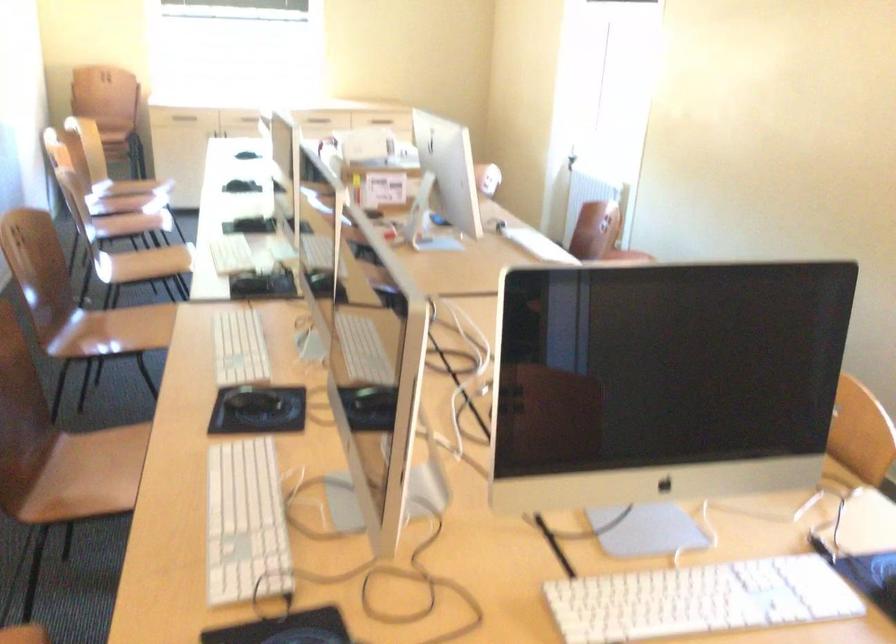
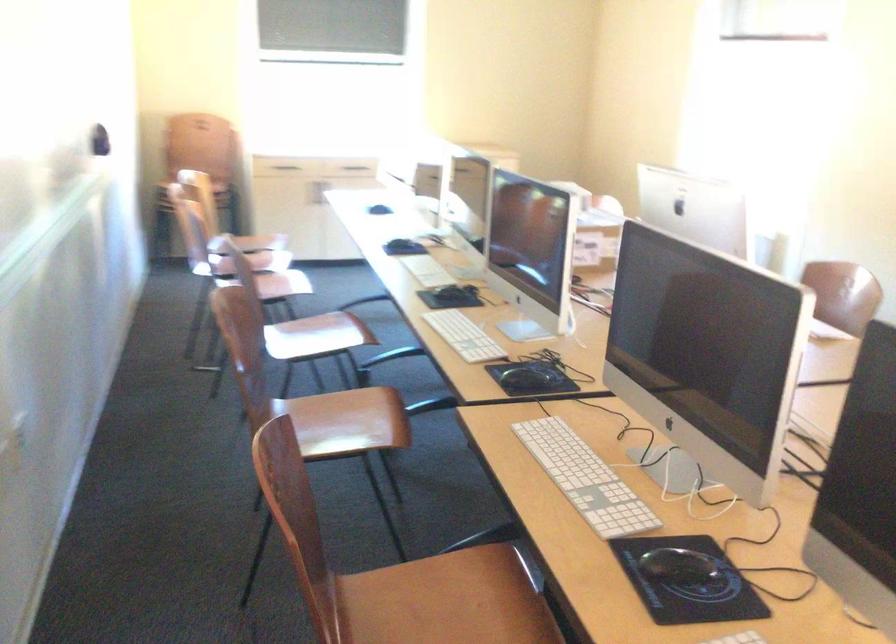
Question: Based on the continuous images, in which direction is the camera rotating? Reply with the corresponding letter.

Choices:
 (A) Left
 (B) Right
 (C) Up
 (D) Down

Answer: (C)